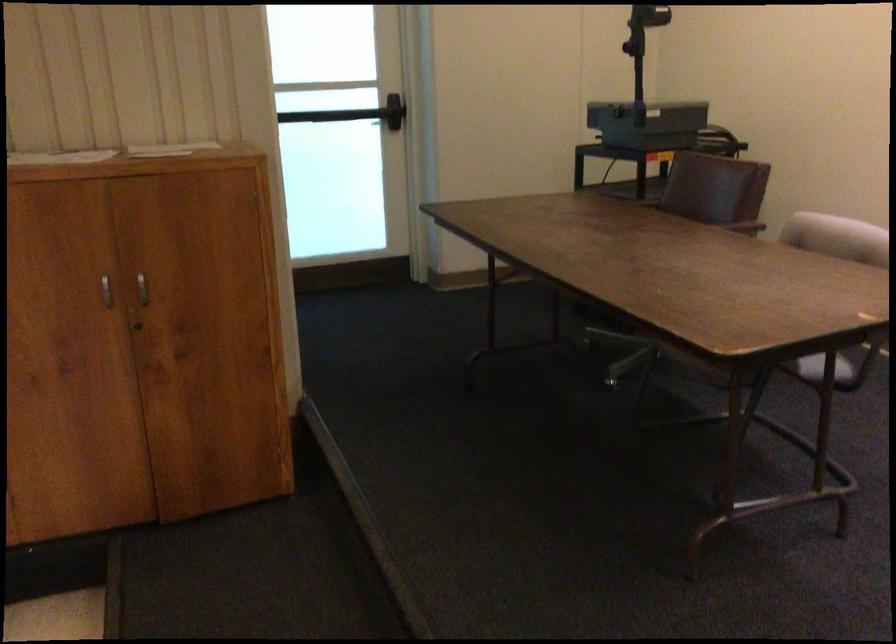
Describe the element at coordinates (334, 115) in the screenshot. The image size is (896, 644). I see `the black door bar` at that location.